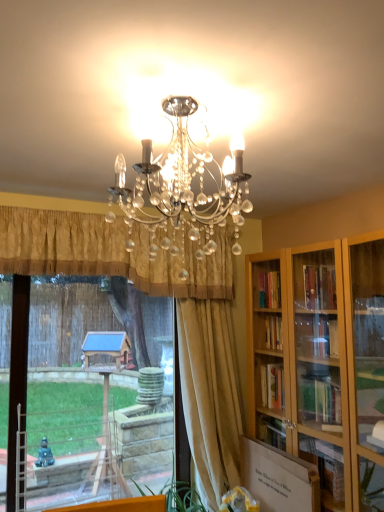
Question: Is gold pleated curtain at center, acting as the 2th curtain starting from the right, taller or shorter than silky beige curtain at center, positioned as the second curtain in left-to-right order?

Choices:
 (A) tall
 (B) short

Answer: (B)

Question: In the image, is gold pleated curtain at center, acting as the 2th curtain starting from the right, positioned in front of or behind silky beige curtain at center, positioned as the second curtain in left-to-right order?

Choices:
 (A) behind
 (B) front

Answer: (B)

Question: Considering the real-world distances, which object is farthest from the gold pleated curtain at center, acting as the 2th curtain starting from the right?

Choices:
 (A) transparent glass window at center
 (B) silky beige curtain at center, positioned as the first curtain in right-to-left order

Answer: (B)

Question: Which object is the farthest from the gold pleated curtain at center, placed as the first curtain when sorted from left to right?

Choices:
 (A) silky beige curtain at center, positioned as the first curtain in right-to-left order
 (B) transparent glass window at center

Answer: (A)